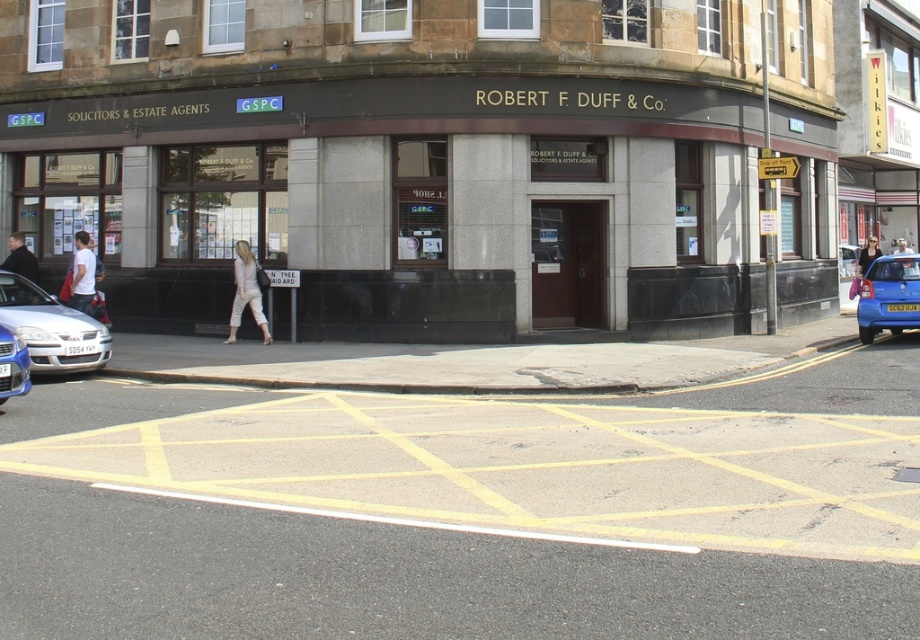
Between metallic blue sedan at lower left and dark blue jacket at left, which one is positioned lower?

Positioned lower is metallic blue sedan at lower left.

Who is more forward, (15, 333) or (31, 257)?

Point (15, 333) is in front.

In order to click on metallic blue sedan at lower left in this screenshot , I will do `click(12, 365)`.

Between point (366, 294) and point (909, 266), which one is positioned behind?

The point (909, 266) is more distant.

Does matte gray building at center have a smaller size compared to light brown leather jacket at upper center?

Actually, matte gray building at center might be larger than light brown leather jacket at upper center.

Which is behind, point (362, 136) or point (905, 244)?

Positioned behind is point (905, 244).

Identify the location of matte gray building at center. This screenshot has height=640, width=920. pos(394,241).

Between white cotton shirt at left and light brown leather jacket at upper right, which one is positioned lower?

white cotton shirt at left is below.

Who is higher up, white cotton shirt at left or light brown leather jacket at upper right?

light brown leather jacket at upper right

Where is `white cotton shirt at left`? white cotton shirt at left is located at coordinates (82, 273).